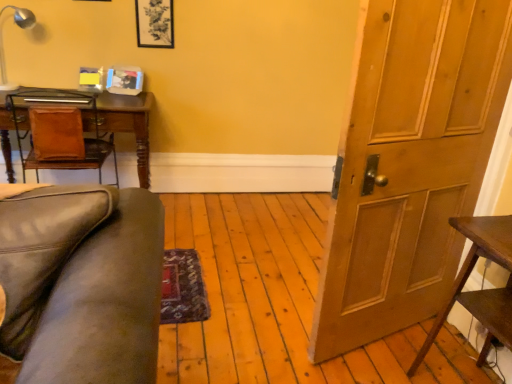
This screenshot has width=512, height=384. Describe the element at coordinates (79, 125) in the screenshot. I see `brown leather desk at left` at that location.

The image size is (512, 384). What do you see at coordinates (21, 16) in the screenshot? I see `metallic silver lamp at upper left` at bounding box center [21, 16].

Describe the element at coordinates (480, 290) in the screenshot. This screenshot has height=384, width=512. I see `dark brown wooden table at right` at that location.

The width and height of the screenshot is (512, 384). Identify the location of brown leather desk at left. (79, 125).

From a real-world perspective, is brown leather desk at left beneath matte black picture frame at upper center?

Yes, from a real-world perspective, brown leather desk at left is under matte black picture frame at upper center.

Does brown leather desk at left have a greater height compared to matte black picture frame at upper center?

Indeed, brown leather desk at left has a greater height compared to matte black picture frame at upper center.

Is brown leather desk at left in contact with matte black picture frame at upper center?

No, brown leather desk at left is not with matte black picture frame at upper center.

Which of these two, wooden door at right or brown leather desk at left, is smaller?

wooden door at right.

Is wooden door at right positioned behind brown leather desk at left?

No.

Based on their positions, is wooden door at right located to the left or right of brown leather desk at left?

Clearly, wooden door at right is on the right of brown leather desk at left in the image.

Does point (336, 345) appear closer or farther from the camera than point (148, 187)?

Clearly, point (336, 345) is closer to the camera than point (148, 187).

From a real-world perspective, between wooden door at right and dark brown wooden table at right, who is vertically higher?

wooden door at right.

Is wooden door at right thinner than dark brown wooden table at right?

Indeed, wooden door at right has a lesser width compared to dark brown wooden table at right.

Considering the relative sizes of wooden door at right and dark brown wooden table at right in the image provided, is wooden door at right smaller than dark brown wooden table at right?

Actually, wooden door at right might be larger than dark brown wooden table at right.

Consider the image. Relative to dark brown wooden table at right, is wooden door at right in front or behind?

Visually, wooden door at right is located behind dark brown wooden table at right.

Considering the points (33, 17) and (468, 229), which point is behind, point (33, 17) or point (468, 229)?

The point (33, 17) is farther.

From a real-world perspective, is metallic silver lamp at upper left physically above dark brown wooden table at right?

Indeed, from a real-world perspective, metallic silver lamp at upper left stands above dark brown wooden table at right.

Is metallic silver lamp at upper left situated inside dark brown wooden table at right or outside?

metallic silver lamp at upper left is located beyond the bounds of dark brown wooden table at right.

Considering the sizes of objects metallic silver lamp at upper left and dark brown wooden table at right in the image provided, who is bigger, metallic silver lamp at upper left or dark brown wooden table at right?

dark brown wooden table at right.

From the image's perspective, does metallic silver lamp at upper left appear higher than wooden door at right?

Correct, metallic silver lamp at upper left appears higher than wooden door at right in the image.

Is wooden door at right a part of metallic silver lamp at upper left?

No, wooden door at right is not inside metallic silver lamp at upper left.

Is metallic silver lamp at upper left positioned with its back to wooden door at right?

No, metallic silver lamp at upper left is not facing away from wooden door at right.

Between metallic silver lamp at upper left and wooden door at right, which one has less height?

metallic silver lamp at upper left is shorter.

Which object is further away from the camera, wooden door at right or matte black picture frame at upper center?

matte black picture frame at upper center is further from the camera.

From a real-world perspective, which object stands above the other?

matte black picture frame at upper center.

In terms of width, does wooden door at right look wider or thinner when compared to matte black picture frame at upper center?

Clearly, wooden door at right has more width compared to matte black picture frame at upper center.

Is wooden door at right to the left of matte black picture frame at upper center from the viewer's perspective?

No, wooden door at right is not to the left of matte black picture frame at upper center.

Considering the sizes of matte black picture frame at upper center and metallic silver lamp at upper left in the image, is matte black picture frame at upper center taller or shorter than metallic silver lamp at upper left?

Clearly, matte black picture frame at upper center is shorter compared to metallic silver lamp at upper left.

Looking at this image, which point is more distant from viewer, (159, 32) or (20, 17)?

The point (159, 32) is farther from the camera.

Looking at this image, does matte black picture frame at upper center appear on the left side of metallic silver lamp at upper left?

Incorrect, matte black picture frame at upper center is not on the left side of metallic silver lamp at upper left.

Locate an element on the screen. This screenshot has width=512, height=384. computer desk that is in front of the matte black picture frame at upper center is located at coordinates (79, 125).

The image size is (512, 384). What are the coordinates of `computer desk that appears above the wooden door at right (from the image's perspective)` in the screenshot? It's located at (79, 125).

When comparing their distances from brown leather desk at left, does metallic silver lamp at upper left or wooden door at right seem closer?

metallic silver lamp at upper left is positioned closer to the anchor brown leather desk at left.

From the image, which object appears to be farther from brown leather desk at left, matte black picture frame at upper center or dark brown wooden table at right?

dark brown wooden table at right is positioned further to the anchor brown leather desk at left.

Estimate the real-world distances between objects in this image. Which object is closer to dark brown wooden table at right, brown leather desk at left or wooden door at right?

The object closer to dark brown wooden table at right is wooden door at right.

Estimate the real-world distances between objects in this image. Which object is further from matte black picture frame at upper center, wooden door at right or brown leather desk at left?

wooden door at right is positioned further to the anchor matte black picture frame at upper center.

Based on their spatial positions, is brown leather desk at left or metallic silver lamp at upper left further from dark brown wooden table at right?

metallic silver lamp at upper left is further to dark brown wooden table at right.

In the scene shown: When comparing their distances from metallic silver lamp at upper left, does dark brown wooden table at right or matte black picture frame at upper center seem closer?

matte black picture frame at upper center is closer to metallic silver lamp at upper left.

Looking at the image, which one is located further to brown leather desk at left, wooden door at right or matte black picture frame at upper center?

Among the two, wooden door at right is located further to brown leather desk at left.

Based on the photo, which object lies further to the anchor point brown leather desk at left, wooden door at right or metallic silver lamp at upper left?

Based on the image, wooden door at right appears to be further to brown leather desk at left.

Find the location of a particular element. lamp that lies between matte black picture frame at upper center and brown leather desk at left from top to bottom is located at coordinates (21, 16).

The height and width of the screenshot is (384, 512). Identify the location of picture frame situated between brown leather desk at left and wooden door at right from left to right. (155, 23).

Where is `picture frame between metallic silver lamp at upper left and wooden door at right from left to right`? picture frame between metallic silver lamp at upper left and wooden door at right from left to right is located at coordinates (155, 23).

Locate an element on the screen. picture frame between brown leather desk at left and dark brown wooden table at right is located at coordinates [155, 23].